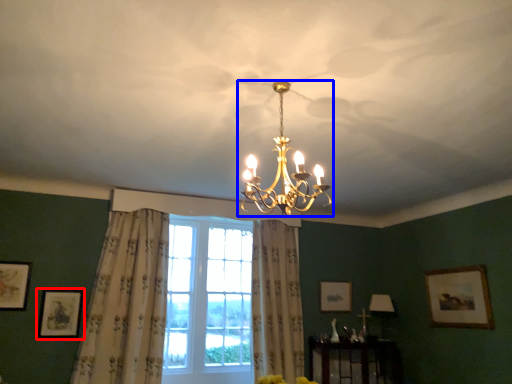
Question: Which of the following is the closest to the observer, picture frame (highlighted by a red box) or lamp (highlighted by a blue box)?

Choices:
 (A) picture frame
 (B) lamp

Answer: (B)